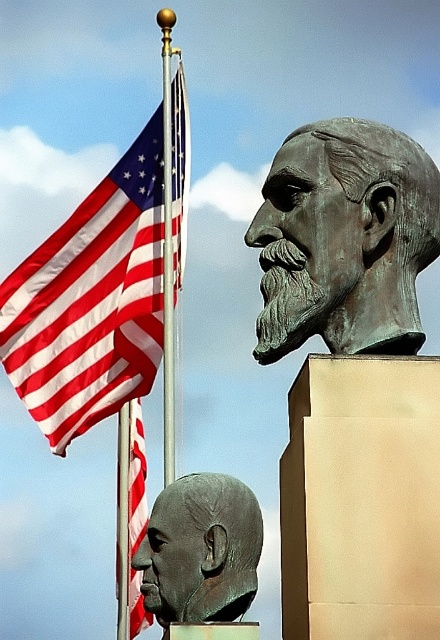
You are an art student standing in front of two bronze sculptures. You notice the bronze statue at upper center and the bronze head at center. Which sculpture do you think is nearer to you?

The bronze statue at upper center is closer to the viewer than the bronze head at center.

You are standing in front of two bronze busts. The first bust is at point (360, 180) and the second is at point (209, 508). If you want to take a photo that includes both busts, which one should you focus on first to ensure both are in frame?

You should focus on point (360, 180) first because it is in front of point (209, 508), ensuring both are captured in the frame.